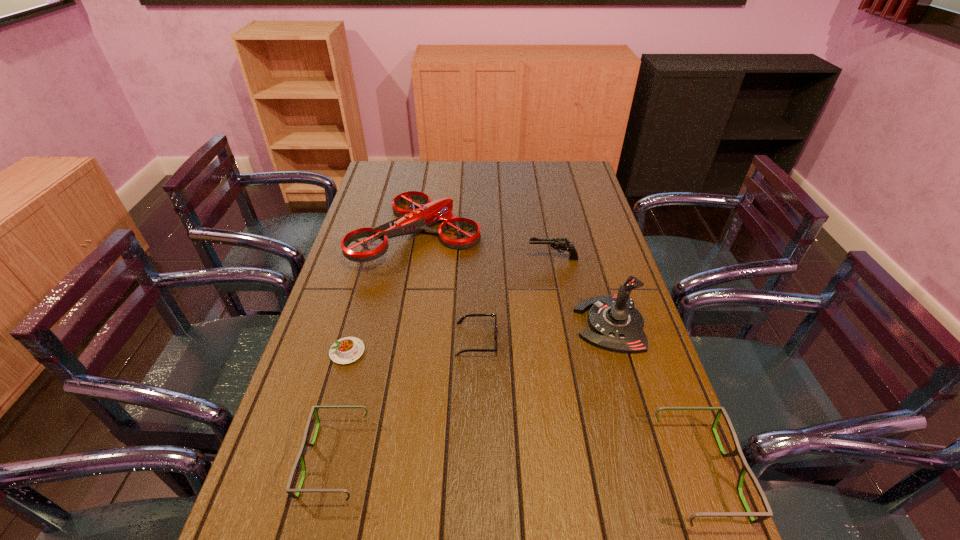
The width and height of the screenshot is (960, 540). In order to click on free region at the far right corner of the desktop in this screenshot , I will do `click(575, 181)`.

The height and width of the screenshot is (540, 960). Identify the location of vacant space at the near right corner of the desktop. (642, 517).

You are a GUI agent. You are given a task and a screenshot of the screen. Output one action in this format:
    pyautogui.click(x=<x>, y=<y>)
    Task: Click on the vacant space in between the drone and the left spectacles
    
    Given the screenshot: What is the action you would take?
    pyautogui.click(x=376, y=346)

Find the location of a particular element. The width and height of the screenshot is (960, 540). free spot between the gun and the tallest object is located at coordinates (581, 292).

The height and width of the screenshot is (540, 960). What are the coordinates of `empty space that is in between the right spectacles and the joystick` in the screenshot? It's located at (654, 399).

The height and width of the screenshot is (540, 960). Identify the location of empty space between the left spectacles and the tallest object. (472, 392).

Identify the location of free spot between the gun and the taller spectacles. The image size is (960, 540). (626, 366).

This screenshot has width=960, height=540. In order to click on free space that is in between the pudding and the gun in this screenshot , I will do `click(450, 305)`.

Where is `free space between the sunglasses and the shortest object`? This screenshot has width=960, height=540. free space between the sunglasses and the shortest object is located at coordinates (412, 346).

Locate an element on the screen. free area in between the gun and the shortest object is located at coordinates 450,305.